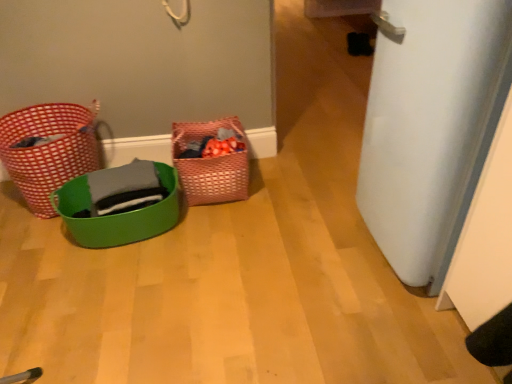
Question: Is red woven basket at left, the third basket when ordered from right to left, shorter than woven pink basket at center, arranged as the 1th basket when viewed from the right?

Choices:
 (A) yes
 (B) no

Answer: (B)

Question: Is red woven basket at left, the third basket when ordered from right to left, smaller than woven pink basket at center, arranged as the 1th basket when viewed from the right?

Choices:
 (A) no
 (B) yes

Answer: (A)

Question: Are red woven basket at left, the third basket when ordered from right to left, and woven pink basket at center, arranged as the 1th basket when viewed from the right, far apart?

Choices:
 (A) yes
 (B) no

Answer: (B)

Question: Is red woven basket at left, the 1th basket in the left-to-right sequence, facing towards woven pink basket at center, arranged as the 1th basket when viewed from the right?

Choices:
 (A) no
 (B) yes

Answer: (A)

Question: From a real-world perspective, is red woven basket at left, the 1th basket in the left-to-right sequence, on woven pink basket at center, marked as the third basket in a left-to-right arrangement?

Choices:
 (A) yes
 (B) no

Answer: (A)

Question: Considering the positions of point (237, 183) and point (97, 148), is point (237, 183) closer or farther from the camera than point (97, 148)?

Choices:
 (A) farther
 (B) closer

Answer: (B)

Question: Would you say woven pink basket at center, marked as the third basket in a left-to-right arrangement, is to the left or to the right of red woven basket at left, the 1th basket in the left-to-right sequence, in the picture?

Choices:
 (A) left
 (B) right

Answer: (B)

Question: Is woven pink basket at center, marked as the third basket in a left-to-right arrangement, inside or outside of red woven basket at left, the third basket when ordered from right to left?

Choices:
 (A) outside
 (B) inside

Answer: (A)

Question: In terms of height, does woven pink basket at center, arranged as the 1th basket when viewed from the right, look taller or shorter compared to red woven basket at left, the 1th basket in the left-to-right sequence?

Choices:
 (A) tall
 (B) short

Answer: (B)

Question: Is red woven basket at left, the 1th basket in the left-to-right sequence, taller or shorter than green plastic basket at lower left, the second basket when ordered from left to right?

Choices:
 (A) short
 (B) tall

Answer: (B)

Question: Is point (44, 172) closer or farther from the camera than point (80, 177)?

Choices:
 (A) closer
 (B) farther

Answer: (A)

Question: Is red woven basket at left, the 1th basket in the left-to-right sequence, in front of or behind green plastic basket at lower left, the second basket when ordered from left to right, in the image?

Choices:
 (A) front
 (B) behind

Answer: (B)

Question: Based on their sizes in the image, would you say red woven basket at left, the 1th basket in the left-to-right sequence, is bigger or smaller than green plastic basket at lower left, the second basket when ordered from left to right?

Choices:
 (A) small
 (B) big

Answer: (A)

Question: Is red woven basket at left, the third basket when ordered from right to left, wider or thinner than white matte door at right?

Choices:
 (A) thin
 (B) wide

Answer: (A)

Question: Based on their sizes in the image, would you say red woven basket at left, the 1th basket in the left-to-right sequence, is bigger or smaller than white matte door at right?

Choices:
 (A) small
 (B) big

Answer: (A)